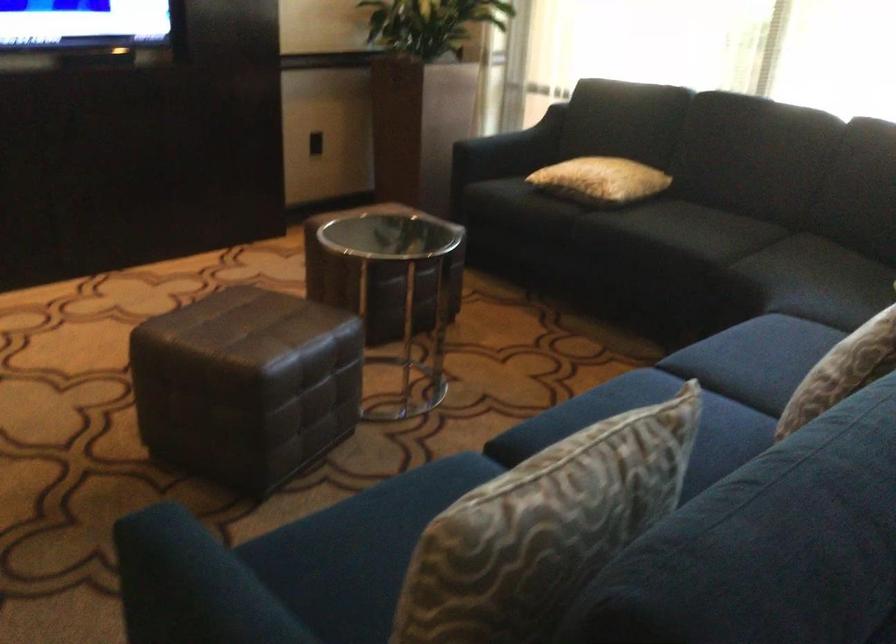
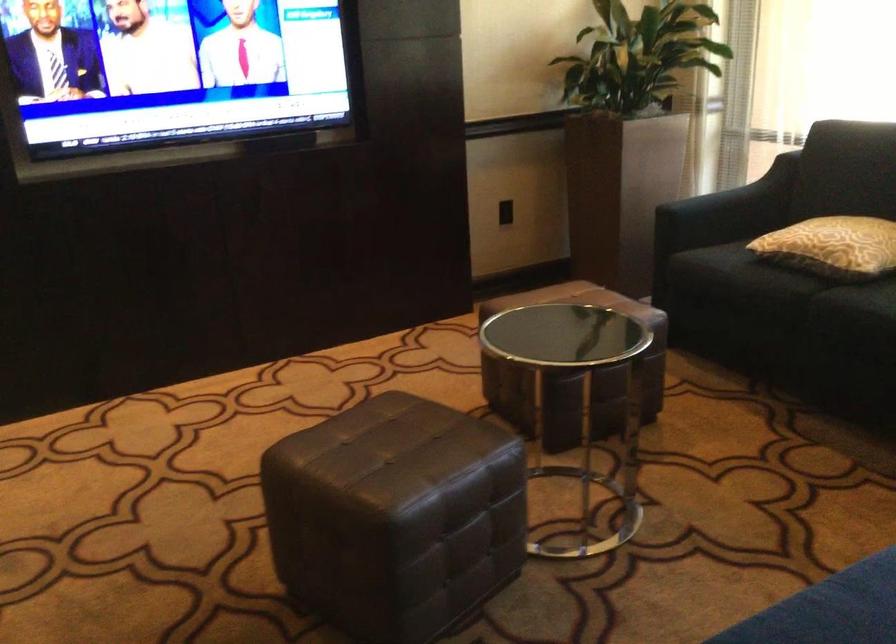
Find the pixel in the second image that matches point (540, 210) in the first image.

(767, 283)